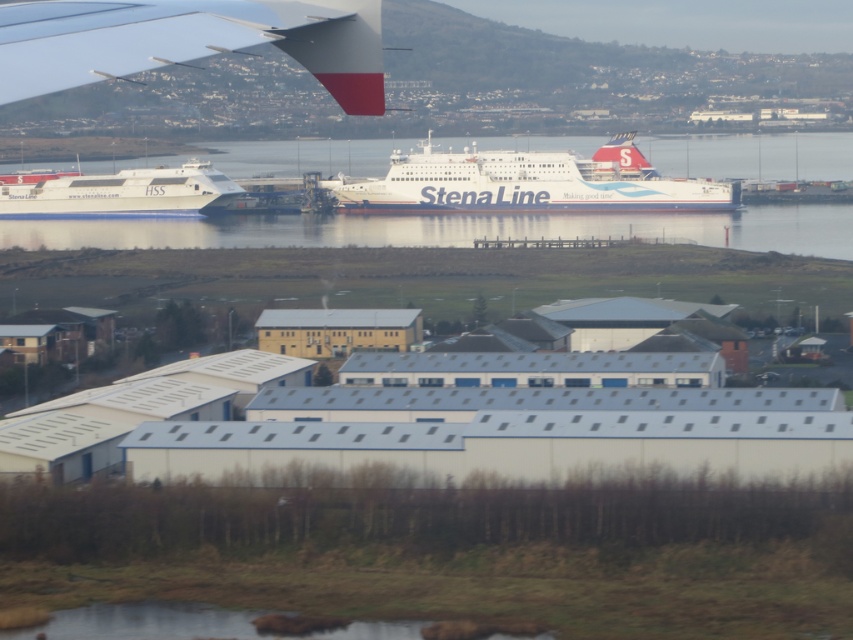
From the picture: Does white glossy water at center lie in front of white matte ferry at center?

No, it is behind white matte ferry at center.

Is white glossy water at center to the left of white matte ferry at center from the viewer's perspective?

Indeed, white glossy water at center is positioned on the left side of white matte ferry at center.

Describe the element at coordinates (451, 228) in the screenshot. I see `white glossy water at center` at that location.

Find the location of a particular element. white glossy water at center is located at coordinates (451, 228).

Describe the element at coordinates (451, 228) in the screenshot. This screenshot has width=853, height=640. I see `white glossy water at center` at that location.

Which of these two, white glossy water at center or white glossy ferry at left, stands taller?

With more height is white glossy ferry at left.

Who is more distant from viewer, (532, 212) or (83, 193)?

The point (83, 193) is behind.

Identify the location of white glossy water at center. (451, 228).

Who is more forward, (149, 61) or (16, 224)?

Point (149, 61) is in front.

The image size is (853, 640). In order to click on white matte airplane wing at upper left in this screenshot , I will do `click(189, 40)`.